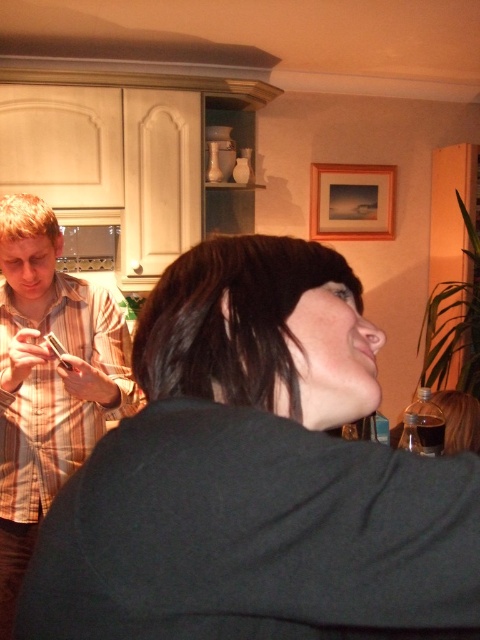
Question: Does plaid shirt at left have a greater width compared to wooden picture frame at upper right?

Choices:
 (A) no
 (B) yes

Answer: (A)

Question: Which point is closer to the camera?

Choices:
 (A) (36, 502)
 (B) (324, 236)
 (C) (91, 588)

Answer: (C)

Question: Can you confirm if dark gray sweater at center is positioned to the right of plaid shirt at left?

Choices:
 (A) no
 (B) yes

Answer: (B)

Question: Can you confirm if dark gray sweater at center is positioned above wooden picture frame at upper right?

Choices:
 (A) no
 (B) yes

Answer: (A)

Question: Which point is closer to the camera?

Choices:
 (A) wooden picture frame at upper right
 (B) dark gray sweater at center
 (C) plaid shirt at left

Answer: (B)

Question: Which object is farther from the camera taking this photo?

Choices:
 (A) wooden picture frame at upper right
 (B) dark gray sweater at center
 (C) plaid shirt at left

Answer: (A)